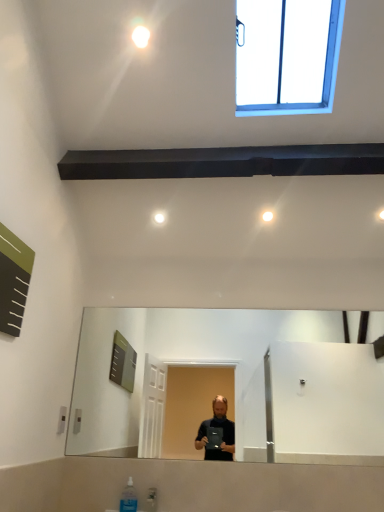
Question: Considering the relative sizes of green matte board at upper left and white glossy light bulb at upper center in the image provided, is green matte board at upper left bigger than white glossy light bulb at upper center?

Choices:
 (A) yes
 (B) no

Answer: (A)

Question: From a real-world perspective, does green matte board at upper left sit lower than white glossy light bulb at upper center?

Choices:
 (A) yes
 (B) no

Answer: (A)

Question: Considering the relative sizes of green matte board at upper left and white glossy light bulb at upper center in the image provided, is green matte board at upper left smaller than white glossy light bulb at upper center?

Choices:
 (A) no
 (B) yes

Answer: (A)

Question: From the image's perspective, is green matte board at upper left on top of white glossy light bulb at upper center?

Choices:
 (A) no
 (B) yes

Answer: (A)

Question: Considering the relative sizes of green matte board at upper left and white glossy light bulb at upper center in the image provided, is green matte board at upper left thinner than white glossy light bulb at upper center?

Choices:
 (A) yes
 (B) no

Answer: (A)

Question: Is green matte board at upper left looking in the opposite direction of white glossy light bulb at upper center?

Choices:
 (A) yes
 (B) no

Answer: (B)

Question: Can you confirm if white glossy light bulb at upper center is smaller than green matte board at upper left?

Choices:
 (A) no
 (B) yes

Answer: (B)

Question: Can you confirm if white glossy light bulb at upper center is positioned to the right of green matte board at upper left?

Choices:
 (A) no
 (B) yes

Answer: (B)

Question: Is green matte board at upper left a part of white glossy light bulb at upper center?

Choices:
 (A) no
 (B) yes

Answer: (A)

Question: Is green matte board at upper left at the back of white glossy light bulb at upper center?

Choices:
 (A) no
 (B) yes

Answer: (A)

Question: Can you confirm if white glossy light bulb at upper center is taller than green matte board at upper left?

Choices:
 (A) yes
 (B) no

Answer: (B)

Question: Is white glossy light bulb at upper center not inside green matte board at upper left?

Choices:
 (A) no
 (B) yes

Answer: (B)

Question: Considering the relative sizes of green matte board at upper left and clear plastic bottle at lower center in the image provided, is green matte board at upper left smaller than clear plastic bottle at lower center?

Choices:
 (A) yes
 (B) no

Answer: (B)